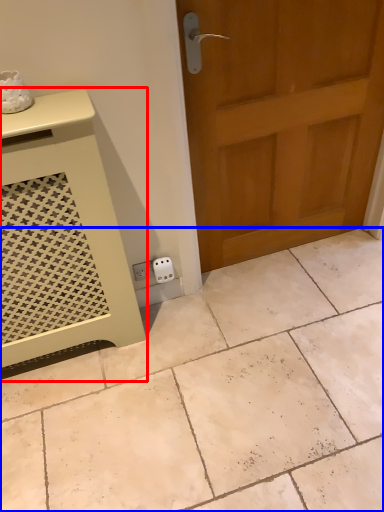
Question: Which object is further to the camera taking this photo, vanity (highlighted by a red box) or ceramic tile (highlighted by a blue box)?

Choices:
 (A) vanity
 (B) ceramic tile

Answer: (B)